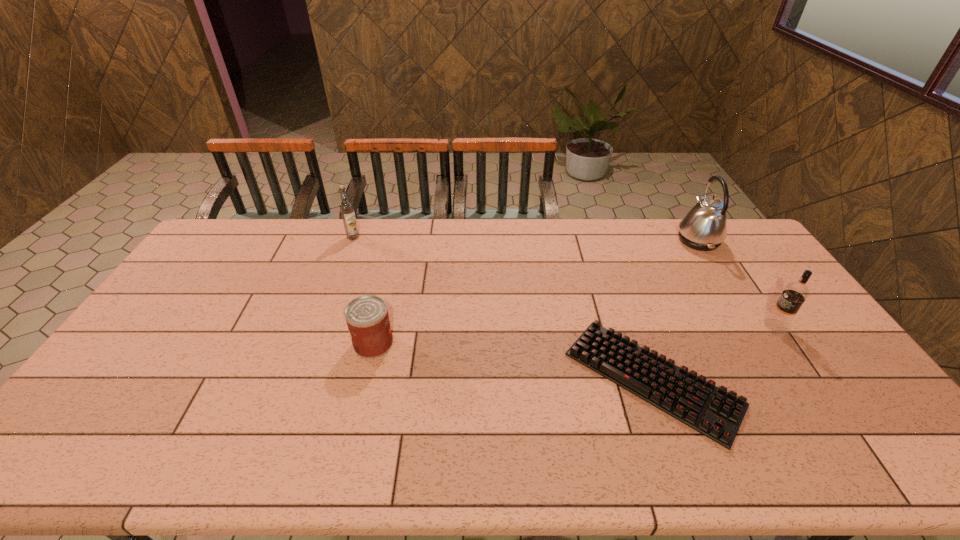
Identify the location of the tallest object. This screenshot has height=540, width=960. pos(704,228).

In order to click on the farther vodka in this screenshot , I will do `click(346, 207)`.

You are a GUI agent. You are given a task and a screenshot of the screen. Output one action in this format:
    pyautogui.click(x=<x>, y=<y>)
    Task: Click on the left vodka
    Image resolution: width=960 pixels, height=540 pixels.
    Given the screenshot: What is the action you would take?
    pyautogui.click(x=346, y=207)

The height and width of the screenshot is (540, 960). In order to click on the right vodka in this screenshot , I will do `click(794, 294)`.

Identify the location of the fourth tallest object. (367, 318).

Locate an element on the screen. can is located at coordinates (367, 318).

At what (x,y) coordinates should I click in order to perform the action: click on the third object from right to left. Please return your answer as a coordinate pair (x, y). The image size is (960, 540). Looking at the image, I should click on (712, 411).

Locate an element on the screen. This screenshot has width=960, height=540. computer keyboard is located at coordinates point(712,411).

The height and width of the screenshot is (540, 960). Identify the location of vacant space situated 0.220m from the spout of the tallest object. (617, 240).

At what (x,y) coordinates should I click in order to perform the action: click on vacant region located from the spout of the tallest object. Please return your answer as a coordinate pair (x, y). Looking at the image, I should click on (658, 240).